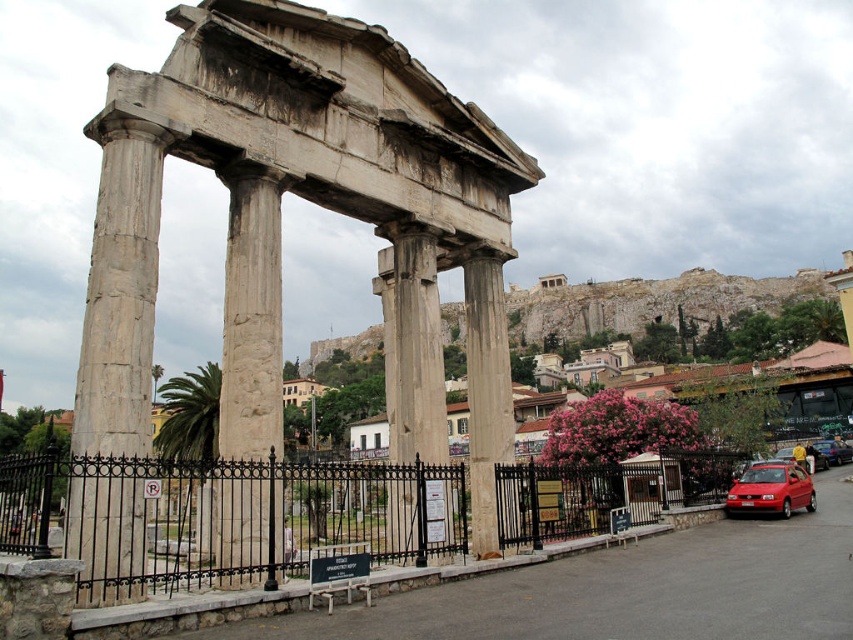
You are a tourist visiting the ancient Roman Agora in Athens. You notice two columns in front of you. One is labeled as the white stone columns at center and the other as the white marble column at center. Which column is closer to you?

The white stone columns at center is closer to you because it is in front of the white marble column at center according to the description.

In the scene shown: You are a tour guide leading a group to the ancient Roman Agora in Athens. You want to ensure your group can hear you clearly. The sound of your voice can travel 25 meters. Will your voice reach the shiny red hatchback at lower right from the white marble column at center?

The white marble column at center is 26.42 meters from the shiny red hatchback at lower right. Since the sound can only travel 25 meters, the voice will not reach the shiny red hatchback at lower right.

What is the relative position of the gray stone column at center compared to the shiny red hatchback at lower right?

The gray stone column at center is to the left of the shiny red hatchback at lower right.